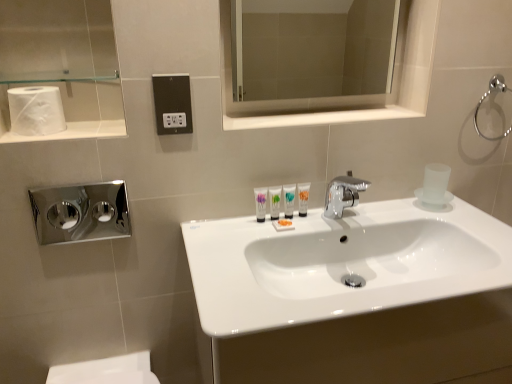
At what (x,y) coordinates should I click in order to perform the action: click on vacant area located to the right-hand side of white glossy tube at center, arranged as the second toiletry when viewed from the right. Please return your answer as a coordinate pair (x, y). Looking at the image, I should click on (318, 221).